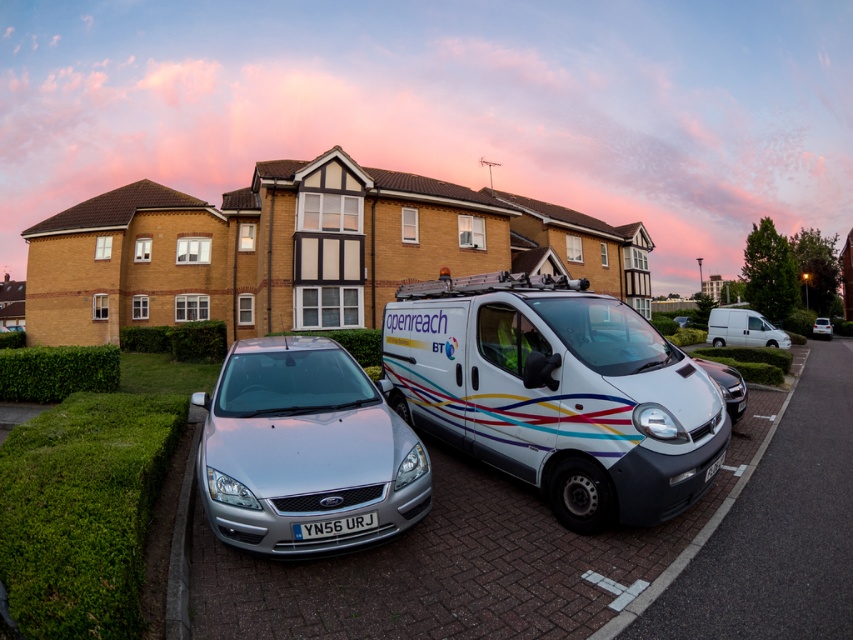
Question: Which point appears farthest from the camera in this image?

Choices:
 (A) (724, 308)
 (B) (434, 316)
 (C) (717, 468)

Answer: (A)

Question: Which is nearer to the white glossy van at center?

Choices:
 (A) silver metallic hatchback at right
 (B) metallic silver van at center
 (C) silver metallic car at center
 (D) white matte van at center-right

Answer: (C)

Question: Is silver metallic car at center closer to the viewer compared to yellow metallic license plate at center?

Choices:
 (A) no
 (B) yes

Answer: (A)

Question: Does gray concrete curb at lower left have a lesser width compared to silver metallic hatchback at right?

Choices:
 (A) yes
 (B) no

Answer: (B)

Question: Which of these objects is positioned farthest from the yellow metallic license plate at center?

Choices:
 (A) white plastic license plate at center
 (B) silver metallic hatchback at right
 (C) white matte van at center-right
 (D) metallic silver van at center

Answer: (B)

Question: Is metallic silver van at center closer to the viewer compared to white plastic license plate at center?

Choices:
 (A) no
 (B) yes

Answer: (A)